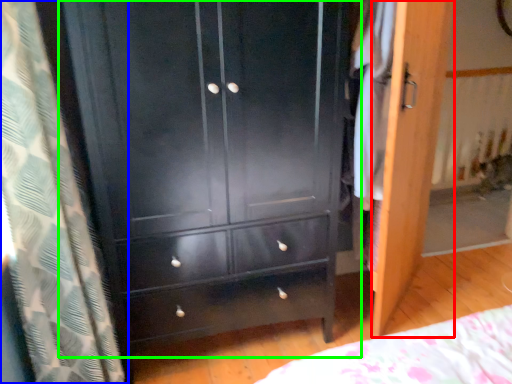
Question: Which object is the farthest from screen door (highlighted by a red box)? Choose among these: curtain (highlighted by a blue box) or chest of drawers (highlighted by a green box).

Choices:
 (A) curtain
 (B) chest of drawers

Answer: (A)